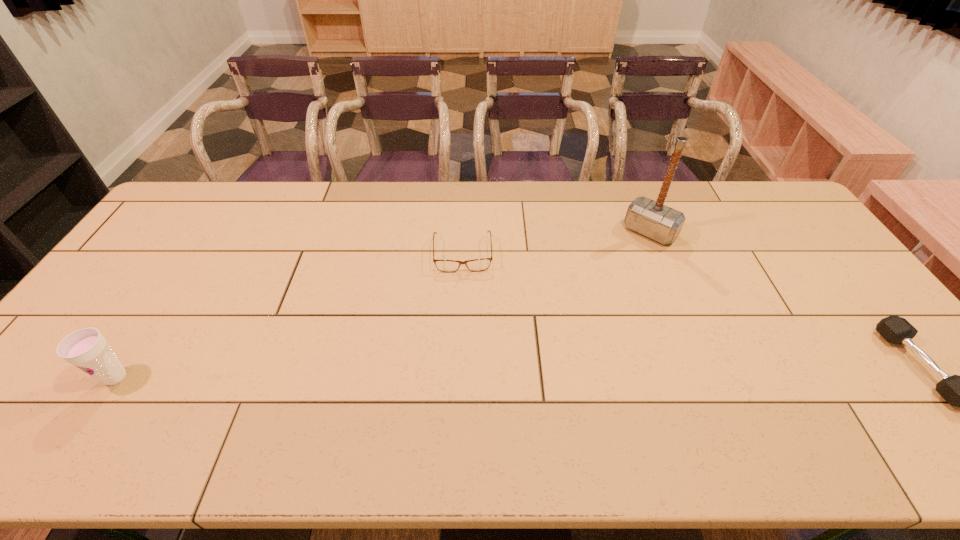
In the image, there is a desktop. Find the location of `vacant region at the right edge`. vacant region at the right edge is located at coordinates (783, 246).

This screenshot has height=540, width=960. Identify the location of free area in between the cup and the shortest object. (289, 315).

Where is `empty location between the cup and the second object from right to left`? empty location between the cup and the second object from right to left is located at coordinates (383, 305).

Identify the location of vacant point located between the second object from left to right and the leftmost object. Image resolution: width=960 pixels, height=540 pixels. (289, 315).

You are a GUI agent. You are given a task and a screenshot of the screen. Output one action in this format:
    pyautogui.click(x=<x>, y=<y>)
    Task: Click on the free space between the shortest object and the leftmost object
    The width and height of the screenshot is (960, 540).
    Given the screenshot: What is the action you would take?
    pyautogui.click(x=289, y=315)

Where is `free point between the hammer and the third shortest object`? free point between the hammer and the third shortest object is located at coordinates (383, 305).

You are a GUI agent. You are given a task and a screenshot of the screen. Output one action in this format:
    pyautogui.click(x=<x>, y=<y>)
    Task: Click on the vacant space that is in between the second tallest object and the spectacles
    This screenshot has width=960, height=540.
    Given the screenshot: What is the action you would take?
    pyautogui.click(x=289, y=315)

Choose which object is the third nearest neighbor to the dumbbell. Please provide its 2D coordinates. Your answer should be formatted as a tuple, i.e. [(x, y)], where the tuple contains the x and y coordinates of a point satisfying the conditions above.

[(87, 349)]

Where is `object identified as the closest to the spectacles`? object identified as the closest to the spectacles is located at coordinates (659, 222).